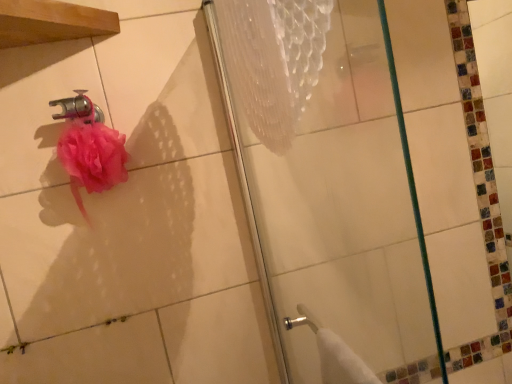
What are the coordinates of `polished chrome faucet at upper left` in the screenshot? It's located at (78, 108).

What is the approximate height of pink fluffy sponge at upper left?

The height of pink fluffy sponge at upper left is 6.17 inches.

The height and width of the screenshot is (384, 512). In order to click on pink fluffy sponge at upper left in this screenshot , I will do `click(93, 156)`.

What do you see at coordinates (325, 190) in the screenshot? This screenshot has height=384, width=512. I see `transparent glass shower door at center` at bounding box center [325, 190].

Find the location of a particular element. The image size is (512, 384). transparent glass shower door at center is located at coordinates (325, 190).

This screenshot has height=384, width=512. In order to click on polished chrome faucet at upper left in this screenshot , I will do `click(78, 108)`.

Identify the location of flower on the left of the transparent glass shower door at center. (93, 156).

From the image's perspective, would you say pink fluffy sponge at upper left is shown under transparent glass shower door at center?

Actually, pink fluffy sponge at upper left appears above transparent glass shower door at center in the image.

Which is more to the right, pink fluffy sponge at upper left or transparent glass shower door at center?

transparent glass shower door at center is more to the right.

Is pink fluffy sponge at upper left touching transparent glass shower door at center?

No, pink fluffy sponge at upper left is not in contact with transparent glass shower door at center.

From the image's perspective, is transparent glass shower door at center located above polished chrome faucet at upper left?

Actually, transparent glass shower door at center appears below polished chrome faucet at upper left in the image.

Based on the photo, is transparent glass shower door at center outside of polished chrome faucet at upper left?

Yes.

Between transparent glass shower door at center and polished chrome faucet at upper left, which one has larger size?

Bigger between the two is transparent glass shower door at center.

Does transparent glass shower door at center come in front of polished chrome faucet at upper left?

Yes.

Is polished chrome faucet at upper left wider than pink fluffy sponge at upper left?

In fact, polished chrome faucet at upper left might be narrower than pink fluffy sponge at upper left.

Considering the sizes of objects polished chrome faucet at upper left and pink fluffy sponge at upper left in the image provided, who is taller, polished chrome faucet at upper left or pink fluffy sponge at upper left?

With more height is pink fluffy sponge at upper left.

Is pink fluffy sponge at upper left inside polished chrome faucet at upper left?

No, pink fluffy sponge at upper left is not a part of polished chrome faucet at upper left.

Which object is closer to the camera taking this photo, polished chrome faucet at upper left or pink fluffy sponge at upper left?

pink fluffy sponge at upper left is closer to the camera.

Is pink fluffy sponge at upper left looking in the opposite direction of polished chrome faucet at upper left?

No, pink fluffy sponge at upper left's orientation is not away from polished chrome faucet at upper left.

Could polished chrome faucet at upper left be considered to be inside pink fluffy sponge at upper left?

No, pink fluffy sponge at upper left does not contain polished chrome faucet at upper left.

Is pink fluffy sponge at upper left taller than polished chrome faucet at upper left?

Yes.

Considering the relative sizes of pink fluffy sponge at upper left and polished chrome faucet at upper left in the image provided, is pink fluffy sponge at upper left wider than polished chrome faucet at upper left?

Yes.

Is polished chrome faucet at upper left thinner than transparent glass shower door at center?

No.

In the scene shown: From the image's perspective, would you say polished chrome faucet at upper left is shown under transparent glass shower door at center?

Actually, polished chrome faucet at upper left appears above transparent glass shower door at center in the image.

How distant is polished chrome faucet at upper left from transparent glass shower door at center?

23.48 inches.

Is polished chrome faucet at upper left at the left side of transparent glass shower door at center?

Correct, you'll find polished chrome faucet at upper left to the left of transparent glass shower door at center.

Does transparent glass shower door at center contain pink fluffy sponge at upper left?

That's incorrect, pink fluffy sponge at upper left is not inside transparent glass shower door at center.

In the scene shown: From a real-world perspective, is transparent glass shower door at center positioned under pink fluffy sponge at upper left based on gravity?

Yes.

Consider the image. Relative to pink fluffy sponge at upper left, is transparent glass shower door at center in front or behind?

In the image, transparent glass shower door at center appears in front of pink fluffy sponge at upper left.

At what (x,y) coordinates should I click in order to perform the action: click on flower on the left of transparent glass shower door at center. Please return your answer as a coordinate pair (x, y). The width and height of the screenshot is (512, 384). Looking at the image, I should click on (93, 156).

Identify the location of flower located on the left of transparent glass shower door at center. The height and width of the screenshot is (384, 512). (93, 156).

At what (x,y) coordinates should I click in order to perform the action: click on faucet above the transparent glass shower door at center (from a real-world perspective). Please return your answer as a coordinate pair (x, y). Looking at the image, I should click on (78, 108).

Based on their spatial positions, is transparent glass shower door at center or pink fluffy sponge at upper left closer to polished chrome faucet at upper left?

pink fluffy sponge at upper left is closer to polished chrome faucet at upper left.

Estimate the real-world distances between objects in this image. Which object is closer to transparent glass shower door at center, polished chrome faucet at upper left or pink fluffy sponge at upper left?

Based on the image, pink fluffy sponge at upper left appears to be nearer to transparent glass shower door at center.

Estimate the real-world distances between objects in this image. Which object is further from pink fluffy sponge at upper left, polished chrome faucet at upper left or transparent glass shower door at center?

transparent glass shower door at center.

Based on their spatial positions, is pink fluffy sponge at upper left or transparent glass shower door at center further from polished chrome faucet at upper left?

Among the two, transparent glass shower door at center is located further to polished chrome faucet at upper left.

Which object lies nearer to the anchor point pink fluffy sponge at upper left, transparent glass shower door at center or polished chrome faucet at upper left?

Among the two, polished chrome faucet at upper left is located nearer to pink fluffy sponge at upper left.

Which object lies further to the anchor point transparent glass shower door at center, pink fluffy sponge at upper left or polished chrome faucet at upper left?

polished chrome faucet at upper left is positioned further to the anchor transparent glass shower door at center.

The image size is (512, 384). I want to click on flower between transparent glass shower door at center and polished chrome faucet at upper left in the front-back direction, so click(x=93, y=156).